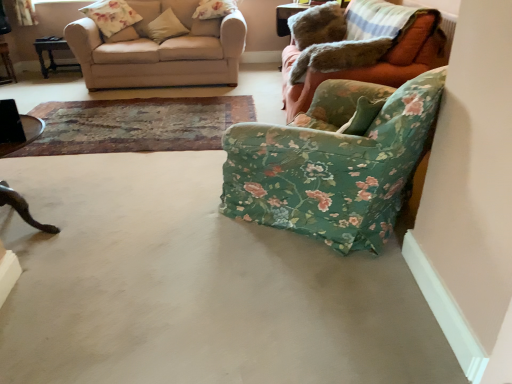
Question: Is floral fabric armchair at right, placed as the 2th studio couch when sorted from left to right, shorter than beige fabric couch at upper left, the second studio couch when ordered from right to left?

Choices:
 (A) no
 (B) yes

Answer: (A)

Question: Considering the relative sizes of floral fabric armchair at right, placed as the 2th studio couch when sorted from left to right, and beige fabric couch at upper left, the 1th studio couch from the left, in the image provided, is floral fabric armchair at right, placed as the 2th studio couch when sorted from left to right, taller than beige fabric couch at upper left, the 1th studio couch from the left,?

Choices:
 (A) no
 (B) yes

Answer: (B)

Question: From a real-world perspective, is floral fabric armchair at right, placed as the 2th studio couch when sorted from left to right, beneath beige fabric couch at upper left, the second studio couch when ordered from right to left?

Choices:
 (A) yes
 (B) no

Answer: (B)

Question: From the image's perspective, is floral fabric armchair at right, which appears as the 1th studio couch when viewed from the right, on top of beige fabric couch at upper left, the second studio couch when ordered from right to left?

Choices:
 (A) no
 (B) yes

Answer: (A)

Question: From a real-world perspective, is floral fabric armchair at right, placed as the 2th studio couch when sorted from left to right, physically above beige fabric couch at upper left, the 1th studio couch from the left?

Choices:
 (A) no
 (B) yes

Answer: (B)

Question: Considering the relative sizes of floral fabric armchair at right, which appears as the 1th studio couch when viewed from the right, and beige fabric couch at upper left, the second studio couch when ordered from right to left, in the image provided, is floral fabric armchair at right, which appears as the 1th studio couch when viewed from the right, bigger than beige fabric couch at upper left, the second studio couch when ordered from right to left,?

Choices:
 (A) yes
 (B) no

Answer: (A)

Question: Does floral fabric pillow at upper left, arranged as the first pillow when viewed from the left, have a greater width compared to beige fabric pillow at upper left, the 2th pillow viewed from the right?

Choices:
 (A) yes
 (B) no

Answer: (A)

Question: Considering the relative sizes of floral fabric pillow at upper left, placed as the 4th pillow when sorted from right to left, and beige fabric pillow at upper left, the 3th pillow when ordered from left to right, in the image provided, is floral fabric pillow at upper left, placed as the 4th pillow when sorted from right to left, shorter than beige fabric pillow at upper left, the 3th pillow when ordered from left to right,?

Choices:
 (A) yes
 (B) no

Answer: (B)

Question: Does floral fabric pillow at upper left, arranged as the first pillow when viewed from the left, have a larger size compared to beige fabric pillow at upper left, the 2th pillow viewed from the right?

Choices:
 (A) yes
 (B) no

Answer: (A)

Question: Does floral fabric pillow at upper left, arranged as the first pillow when viewed from the left, lie behind beige fabric pillow at upper left, the 3th pillow when ordered from left to right?

Choices:
 (A) yes
 (B) no

Answer: (B)

Question: Is floral fabric pillow at upper left, arranged as the first pillow when viewed from the left, to the left of beige fabric pillow at upper left, the 3th pillow when ordered from left to right, from the viewer's perspective?

Choices:
 (A) no
 (B) yes

Answer: (B)

Question: Is floral fabric pillow at upper left, arranged as the first pillow when viewed from the left, taller than beige fabric pillow at upper left, the 2th pillow viewed from the right?

Choices:
 (A) no
 (B) yes

Answer: (B)

Question: Considering the relative sizes of beige fabric couch at upper left, the 1th studio couch from the left, and wooden dark brown table at left, which ranks as the 3th table in back-to-front order, in the image provided, is beige fabric couch at upper left, the 1th studio couch from the left, taller than wooden dark brown table at left, which ranks as the 3th table in back-to-front order,?

Choices:
 (A) no
 (B) yes

Answer: (B)